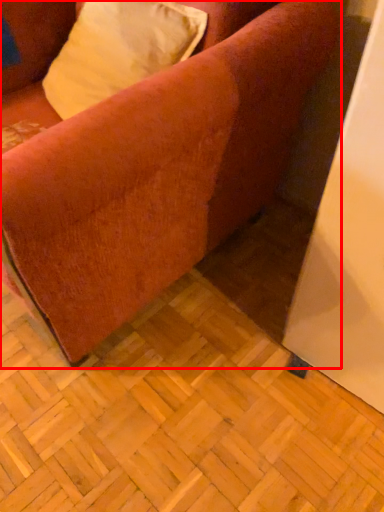
Question: From the image's perspective, what is the correct spatial positioning of studio couch (annotated by the red box) in reference to pillow?

Choices:
 (A) below
 (B) above

Answer: (A)